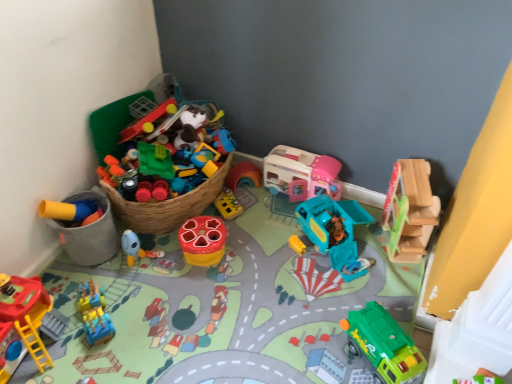
Locate an element on the screen. This screenshot has width=512, height=384. vacant area that lies between pink plastic playhouse at upper right, acting as the fourth toy starting from the right, and blue plastic train at lower left, placed as the second toy when sorted from left to right is located at coordinates (223, 263).